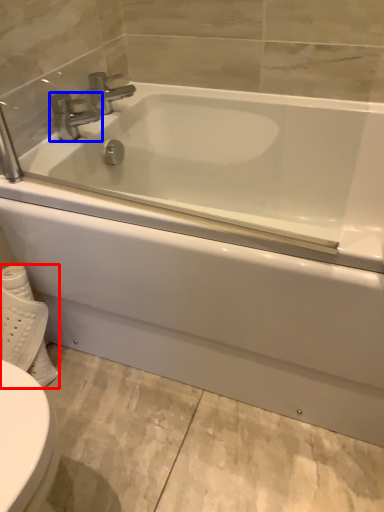
Question: Which of the following is the closest to the observer, toilet paper (highlighted by a red box) or tap (highlighted by a blue box)?

Choices:
 (A) toilet paper
 (B) tap

Answer: (A)